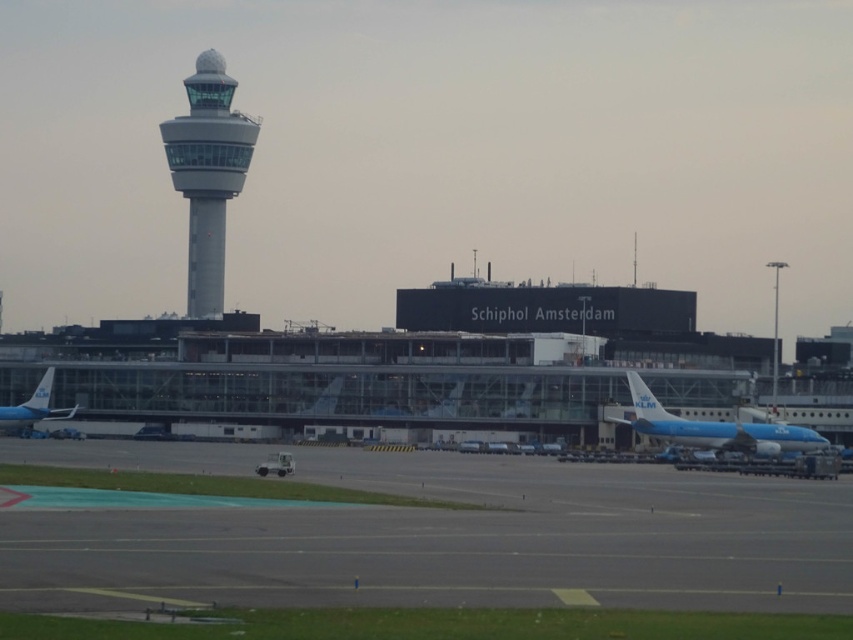
You are a pilot approaching Schiphol Amsterdam Airport. You notice the glassy gray control tower at upper left and the blue metallic airplane at lower right from your cockpit window. Which object appears wider in your view?

The glassy gray control tower at upper left appears wider than the blue metallic airplane at lower right because its width surpasses that of the blue metallic airplane at lower right.